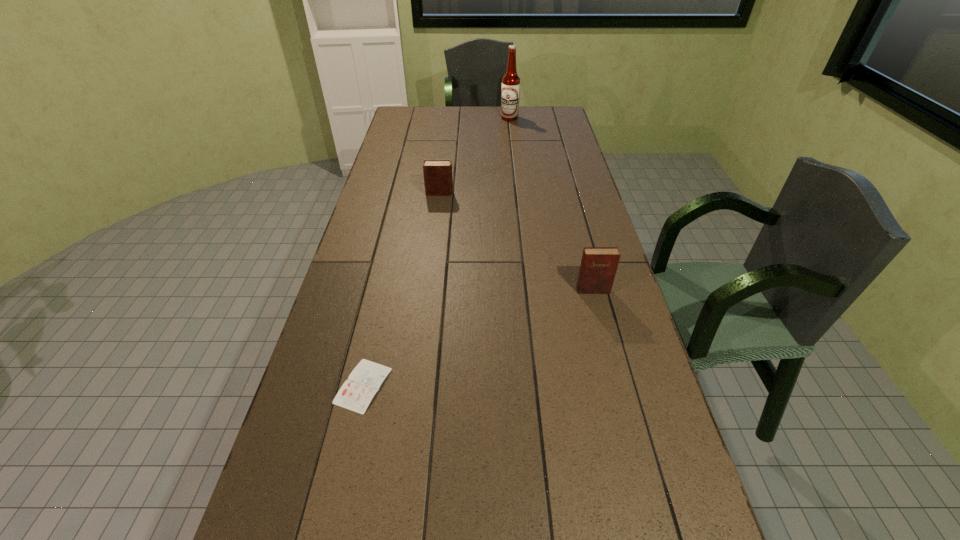
Point out which object is positioned as the third nearest to the rightmost object. Please provide its 2D coordinates. Your answer should be formatted as a tuple, i.e. [(x, y)], where the tuple contains the x and y coordinates of a point satisfying the conditions above.

[(510, 93)]

Identify the location of diary that stands as the second closest to the farthest object. Image resolution: width=960 pixels, height=540 pixels. (598, 267).

Identify the location of diary that can be found as the third closest to the second object from right to left. (356, 393).

At what (x,y) coordinates should I click in order to perform the action: click on free location that satisfies the following two spatial constraints: 1. on the label side of the alcohol; 2. on the spine side of the second shortest object. Please return your answer as a coordinate pair (x, y). Looking at the image, I should click on (518, 193).

Identify the location of free space that satisfies the following two spatial constraints: 1. on the label side of the farthest object; 2. on the spine side of the second farthest object. (518, 193).